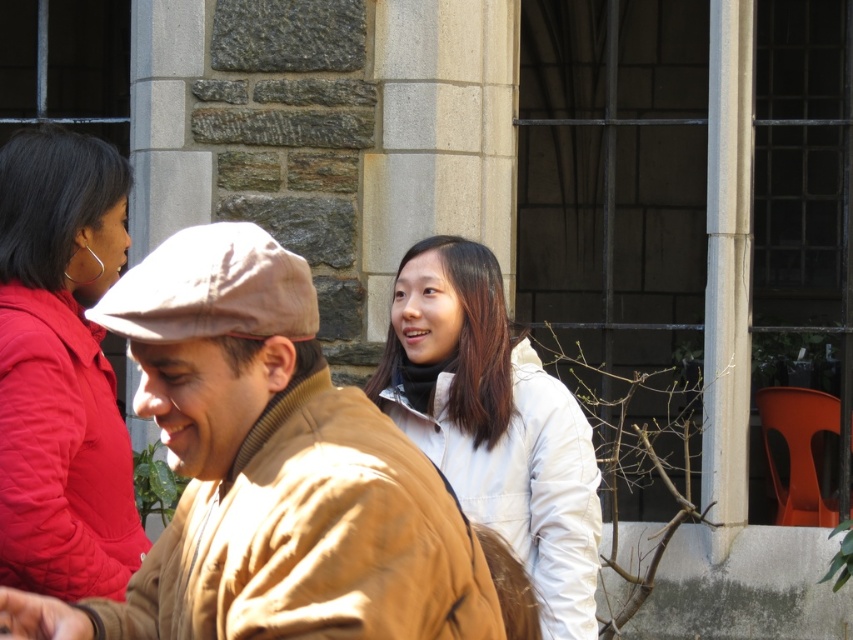
Does point (277, 243) come behind point (79, 182)?

Yes.

Does point (202, 394) come in front of point (102, 388)?

Yes, point (202, 394) is closer to viewer.

Image resolution: width=853 pixels, height=640 pixels. In order to click on brown woolen jacket at center in this screenshot , I will do `click(270, 472)`.

Between point (137, 612) and point (497, 493), which one is positioned behind?

Point (497, 493)

Can you confirm if brown woolen jacket at center is positioned below white matte jacket at center?

Indeed, brown woolen jacket at center is positioned under white matte jacket at center.

Is point (300, 476) more distant than point (438, 381)?

That is False.

You are a GUI agent. You are given a task and a screenshot of the screen. Output one action in this format:
    pyautogui.click(x=<x>, y=<y>)
    Task: Click on the brown woolen jacket at center
    The height and width of the screenshot is (640, 853).
    Given the screenshot: What is the action you would take?
    pyautogui.click(x=270, y=472)

Which is above, quilted red jacket at left or white matte jacket at center?

Positioned higher is quilted red jacket at left.

Is quilted red jacket at left smaller than white matte jacket at center?

Yes.

Locate an element on the screen. quilted red jacket at left is located at coordinates (61, 369).